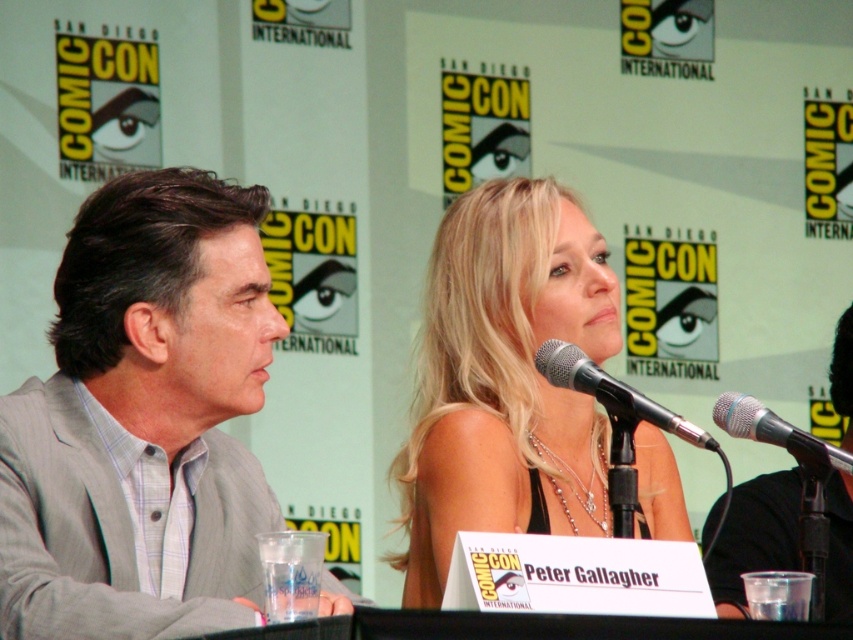
Question: Does black metallic microphone at center have a lesser width compared to silver metallic microphone at center?

Choices:
 (A) yes
 (B) no

Answer: (B)

Question: Which point is farther from the camera taking this photo?

Choices:
 (A) (44, 531)
 (B) (732, 404)
 (C) (585, 497)

Answer: (C)

Question: Can you confirm if gray pinstriped suit at left is positioned to the right of blonde hair at center?

Choices:
 (A) no
 (B) yes

Answer: (A)

Question: Among these objects, which one is nearest to the camera?

Choices:
 (A) black matte microphone at center
 (B) black metallic microphone at center

Answer: (B)

Question: Estimate the real-world distances between objects in this image. Which object is closer to the gray pinstriped suit at left?

Choices:
 (A) black matte microphone at center
 (B) silver metallic microphone at center
 (C) blonde hair at center
 (D) black metallic microphone at center

Answer: (D)

Question: Does gray pinstriped suit at left appear on the left side of black metallic microphone at center?

Choices:
 (A) no
 (B) yes

Answer: (B)